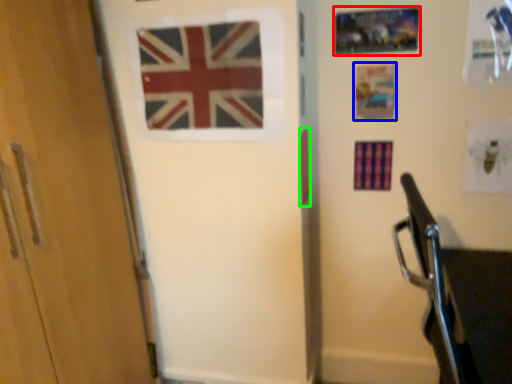
Question: Based on their relative distances, which object is farther from postcard (highlighted by a red box)? Choose from postcard (highlighted by a blue box) and flag (highlighted by a green box).

Choices:
 (A) postcard
 (B) flag

Answer: (B)